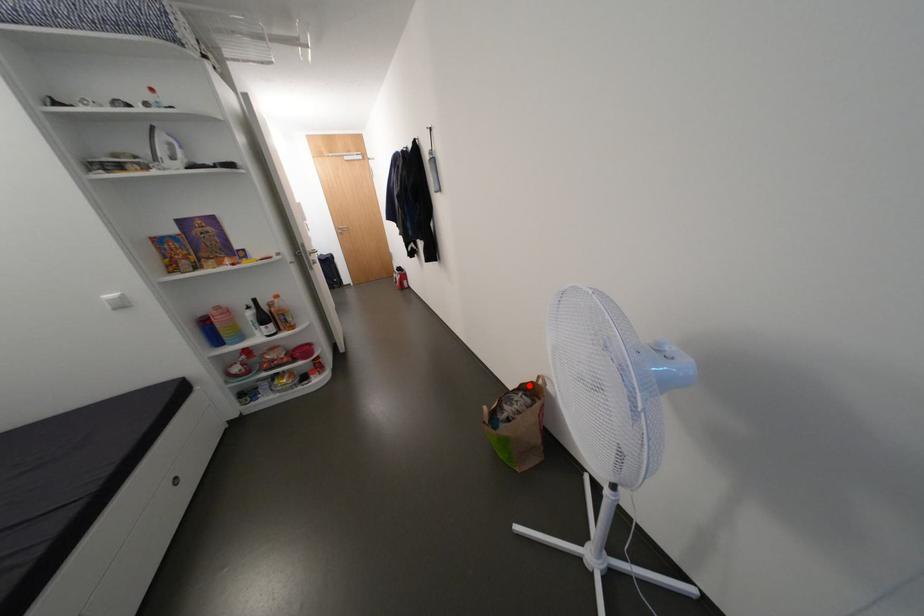
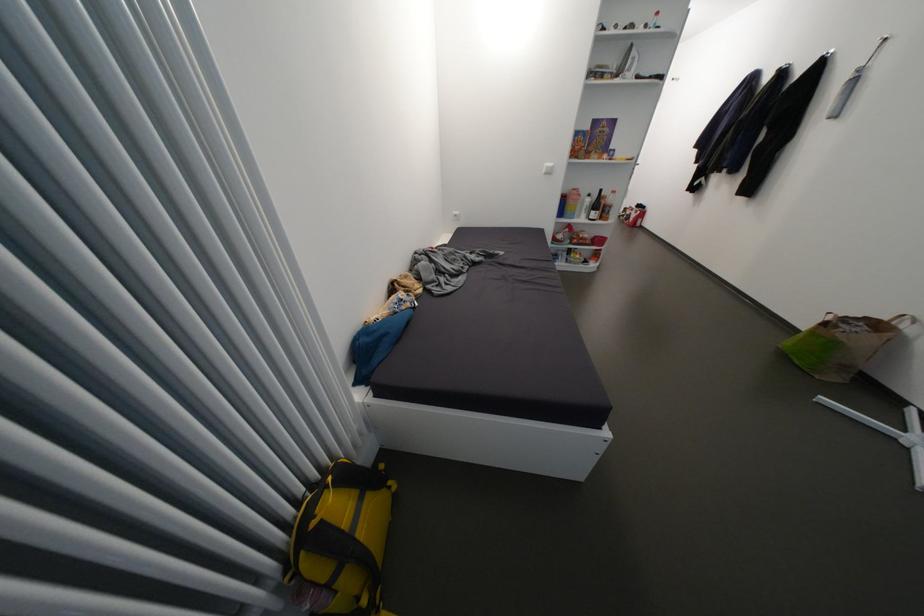
Question: A red point is marked in image1. In image2, is the corresponding 3D point closer to the camera or farther? Reply with the corresponding letter.

Choices:
 (A) The corresponding 3D point is closer.
 (B) The corresponding 3D point is farther.

Answer: (B)